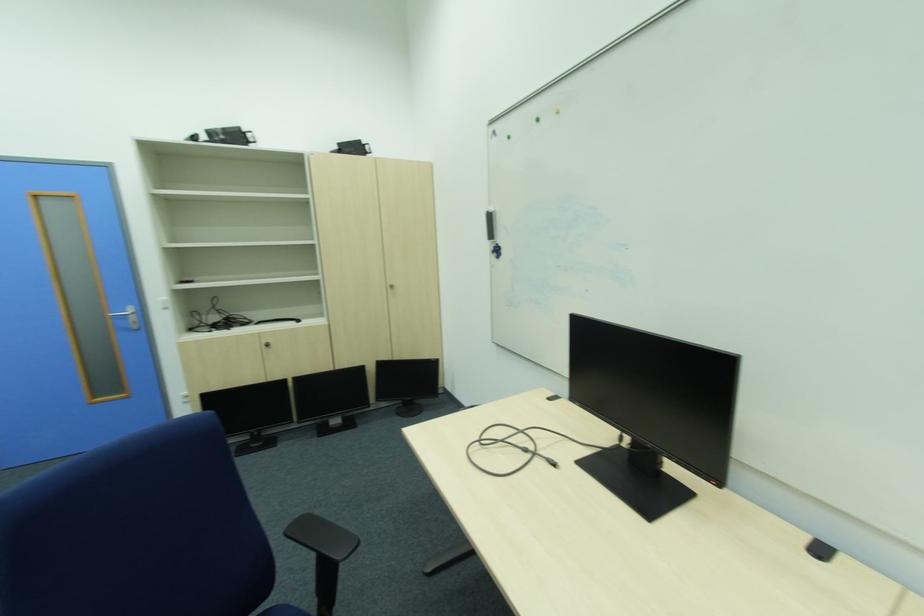
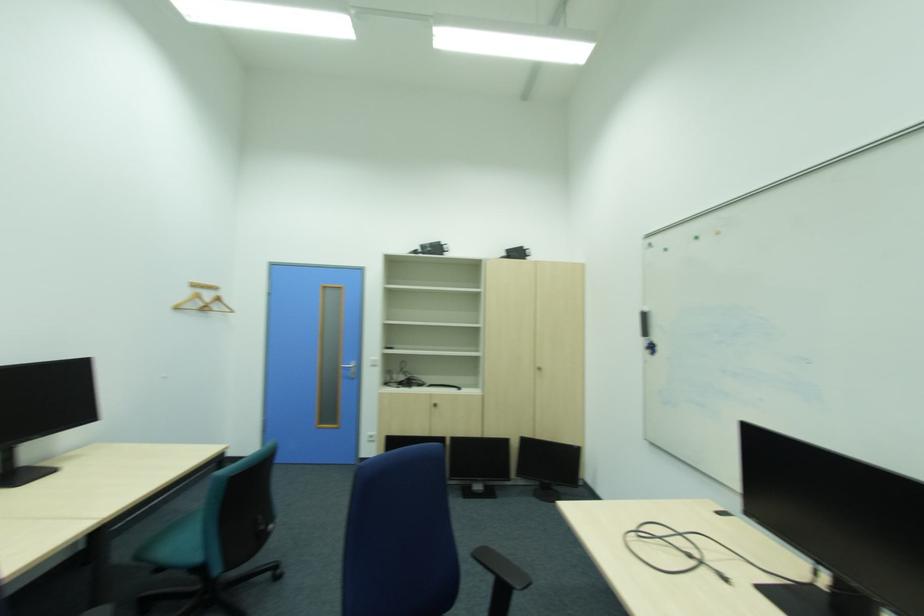
Question: The camera is either moving clockwise (left) or counter-clockwise (right) around the object. The first image is from the beginning of the video and the second image is from the end. Is the camera moving left or right when shooting the video?

Choices:
 (A) Left
 (B) Right

Answer: (B)